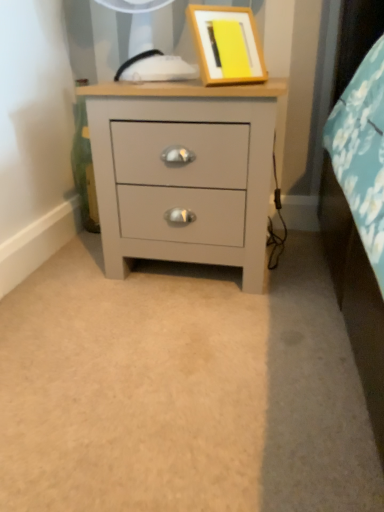
Question: Does wooden picture frame at upper center have a lesser height compared to matte gray chest of drawers at center?

Choices:
 (A) yes
 (B) no

Answer: (A)

Question: Considering the relative sizes of wooden picture frame at upper center and matte gray chest of drawers at center in the image provided, is wooden picture frame at upper center taller than matte gray chest of drawers at center?

Choices:
 (A) yes
 (B) no

Answer: (B)

Question: Is wooden picture frame at upper center at the left side of matte gray chest of drawers at center?

Choices:
 (A) no
 (B) yes

Answer: (A)

Question: Is wooden picture frame at upper center positioned behind matte gray chest of drawers at center?

Choices:
 (A) yes
 (B) no

Answer: (B)

Question: Is wooden picture frame at upper center oriented towards matte gray chest of drawers at center?

Choices:
 (A) yes
 (B) no

Answer: (B)

Question: Is matte gray chest of drawers at center inside wooden picture frame at upper center?

Choices:
 (A) yes
 (B) no

Answer: (B)

Question: Is matte gray chest of drawers at center to the left of wooden picture frame at upper center from the viewer's perspective?

Choices:
 (A) yes
 (B) no

Answer: (A)

Question: From the image's perspective, does matte gray chest of drawers at center appear higher than wooden picture frame at upper center?

Choices:
 (A) no
 (B) yes

Answer: (A)

Question: Is matte gray chest of drawers at center not within wooden picture frame at upper center?

Choices:
 (A) no
 (B) yes

Answer: (B)

Question: Does matte gray chest of drawers at center have a lesser height compared to wooden picture frame at upper center?

Choices:
 (A) no
 (B) yes

Answer: (A)

Question: Can you confirm if matte gray chest of drawers at center is smaller than wooden picture frame at upper center?

Choices:
 (A) yes
 (B) no

Answer: (B)

Question: Does matte gray chest of drawers at center appear on the right side of wooden picture frame at upper center?

Choices:
 (A) yes
 (B) no

Answer: (B)

Question: Based on their positions, is matte gray chest of drawers at center located to the left or right of wooden picture frame at upper center?

Choices:
 (A) left
 (B) right

Answer: (A)